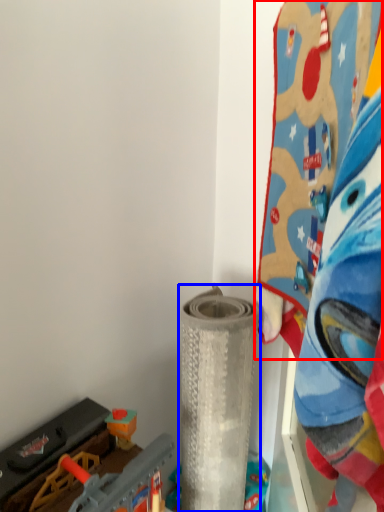
Question: Which of the following is the closest to the observer, toy (highlighted by a red box) or toy (highlighted by a blue box)?

Choices:
 (A) toy
 (B) toy

Answer: (A)